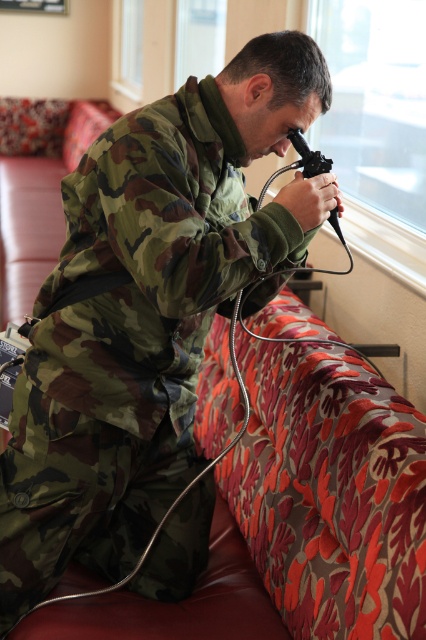
Question: Which point is closer to the camera?

Choices:
 (A) transparent glass window at upper center
 (B) floral fabric couch at lower left

Answer: (A)

Question: Observing the image, what is the correct spatial positioning of transparent glass window at upper center in reference to floral fabric couch at lower left?

Choices:
 (A) left
 (B) right

Answer: (B)

Question: Observing the image, what is the correct spatial positioning of transparent glass window at upper center in reference to floral fabric couch at lower left?

Choices:
 (A) above
 (B) below

Answer: (A)

Question: Which of the following is the closest to the observer?

Choices:
 (A) floral fabric couch at lower left
 (B) transparent glass window at upper center

Answer: (B)

Question: Which point is farther to the camera?

Choices:
 (A) transparent glass window at upper center
 (B) floral fabric couch at lower left

Answer: (B)

Question: Observing the image, what is the correct spatial positioning of transparent glass window at upper center in reference to floral fabric couch at lower left?

Choices:
 (A) right
 (B) left

Answer: (A)